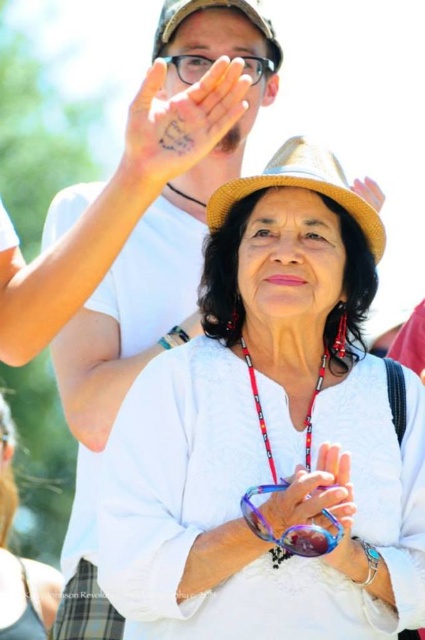
Is white matte shirt at center further to camera compared to matte brown hat at upper center?

That is True.

Is white matte shirt at center thinner than matte brown hat at upper center?

No, white matte shirt at center is not thinner than matte brown hat at upper center.

Where is `white matte shirt at center`? Image resolution: width=425 pixels, height=640 pixels. white matte shirt at center is located at coordinates (20, 560).

You are a GUI agent. You are given a task and a screenshot of the screen. Output one action in this format:
    pyautogui.click(x=<x>, y=<y>)
    Task: Click on the white matte shirt at center
    
    Given the screenshot: What is the action you would take?
    pyautogui.click(x=20, y=560)

Can you confirm if transparent plastic goggles at upper center is smaller than matte brown hat at upper center?

Yes.

Between transparent plastic goggles at upper center and matte brown hat at upper center, which one is positioned lower?

matte brown hat at upper center is lower down.

Does point (243, 72) lie behind point (359, 182)?

Yes, point (243, 72) is farther from viewer.

Locate an element on the screen. The width and height of the screenshot is (425, 640). transparent plastic goggles at upper center is located at coordinates (189, 67).

How far apart are white woven hat at center and matte black glasses at upper center?

They are 8.03 meters apart.

Based on the photo, is white woven hat at center smaller than matte black glasses at upper center?

No, white woven hat at center is not smaller than matte black glasses at upper center.

Identify the location of white woven hat at center. (269, 435).